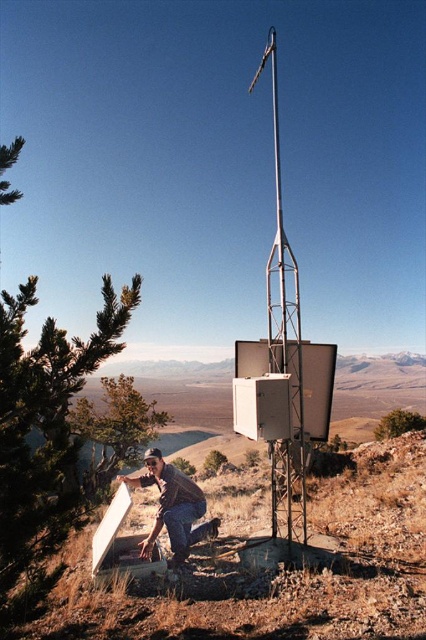
Question: Which object is positioned closest to the brown leather jacket at lower center?

Choices:
 (A) metallic pole at center
 (B) brown dirt at lower left

Answer: (B)

Question: Where is brown dirt at lower left located in relation to metallic pole at center in the image?

Choices:
 (A) left
 (B) right

Answer: (A)

Question: Based on their relative distances, which object is farther from the brown leather jacket at lower center?

Choices:
 (A) metallic pole at center
 (B) brown dirt at lower left

Answer: (A)

Question: Can you confirm if metallic pole at center is wider than brown leather jacket at lower center?

Choices:
 (A) yes
 (B) no

Answer: (A)

Question: Can you confirm if brown dirt at lower left is positioned below brown leather jacket at lower center?

Choices:
 (A) yes
 (B) no

Answer: (A)

Question: Which object appears farthest from the camera in this image?

Choices:
 (A) metallic pole at center
 (B) brown leather jacket at lower center

Answer: (A)